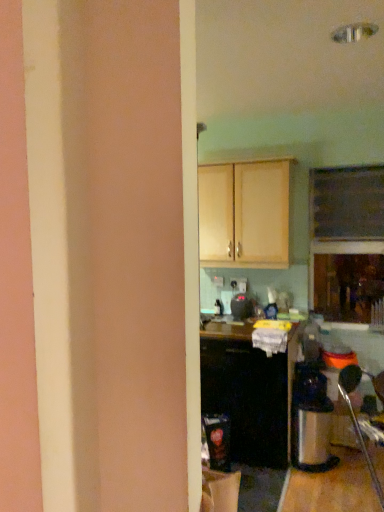
Question: In terms of width, does black matte cabinet at center, which is the first cabinetry in bottom-to-top order, look wider or thinner when compared to light wood cabinet at upper center, arranged as the 1th cabinetry when viewed from the top?

Choices:
 (A) wide
 (B) thin

Answer: (A)

Question: Would you say black matte cabinet at center, the 2th cabinetry viewed from the top, is inside or outside light wood cabinet at upper center, arranged as the 1th cabinetry when viewed from the top?

Choices:
 (A) outside
 (B) inside

Answer: (A)

Question: Which object is positioned farthest from the light wood cabinet at upper center, arranged as the 1th cabinetry when viewed from the top?

Choices:
 (A) black matte cabinet at center, the 2th cabinetry viewed from the top
 (B) black plastic toaster at center

Answer: (A)

Question: Which of these objects is positioned farthest from the black matte cabinet at center, the 2th cabinetry viewed from the top?

Choices:
 (A) black plastic toaster at center
 (B) light wood cabinet at upper center, which is the 2th cabinetry from bottom to top

Answer: (B)